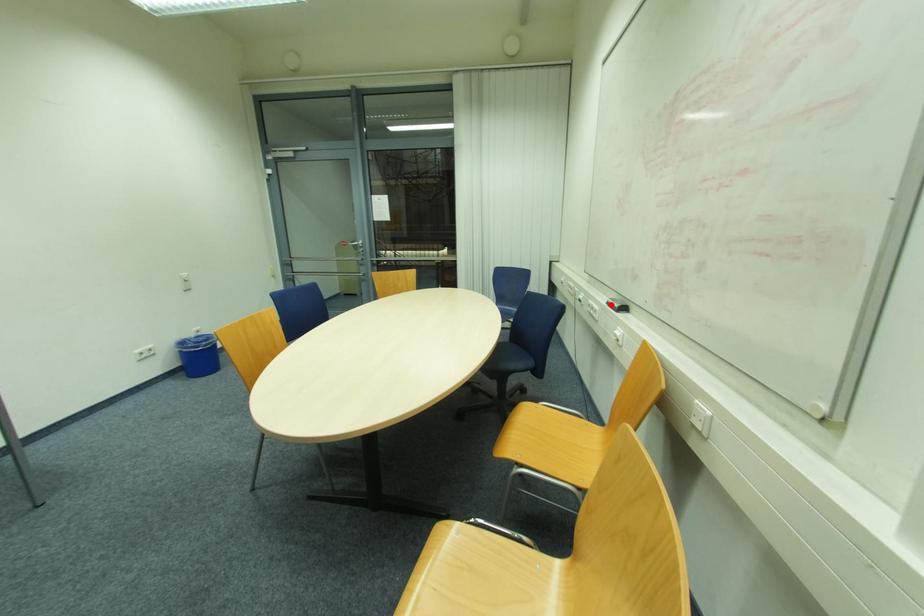
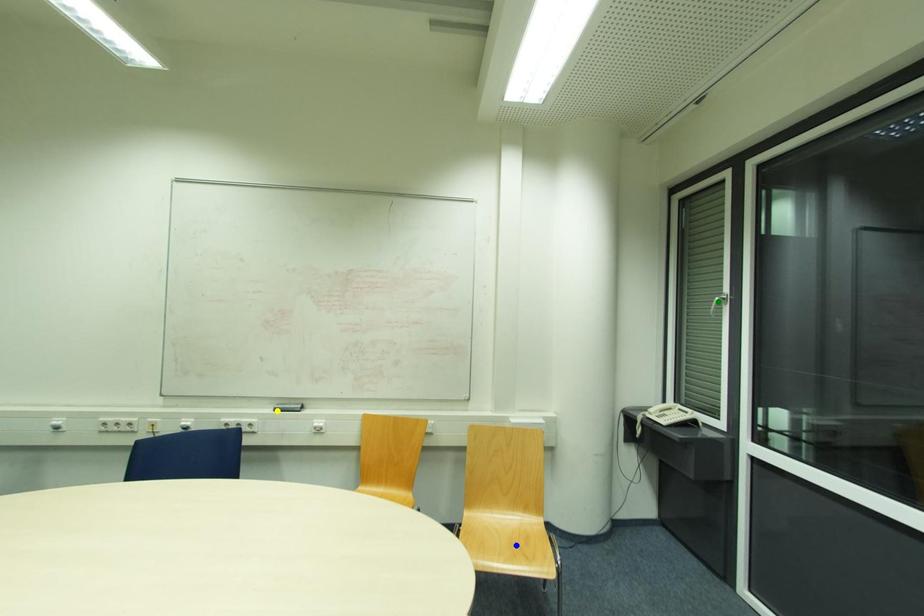
Question: I am providing you with two images of the same scene from different viewpoints. A red point is marked on the first image. You are given multiple points on the second image. Which point in image 2 represents the same 3d spot as the red point in image 1?

Choices:
 (A) blue point
 (B) green point
 (C) yellow point

Answer: (C)